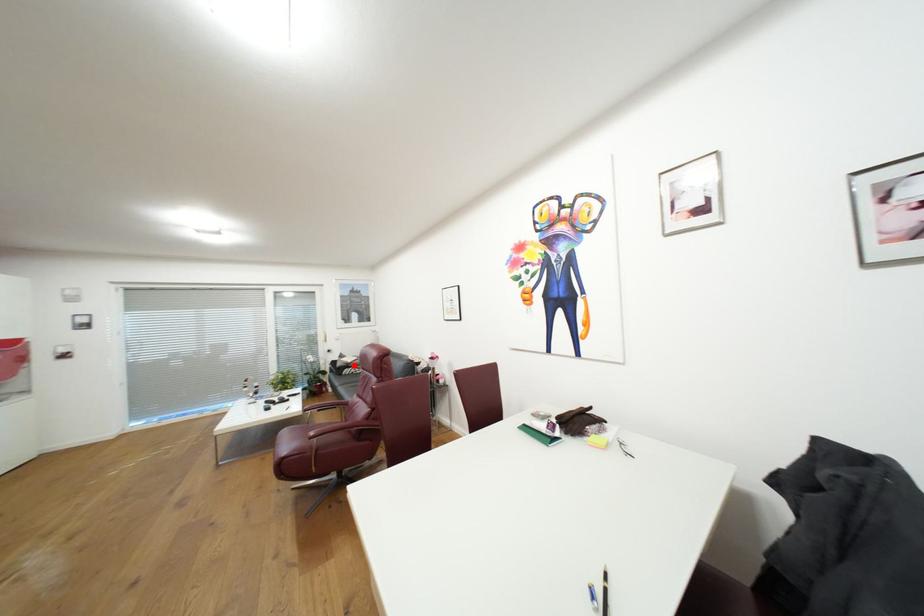
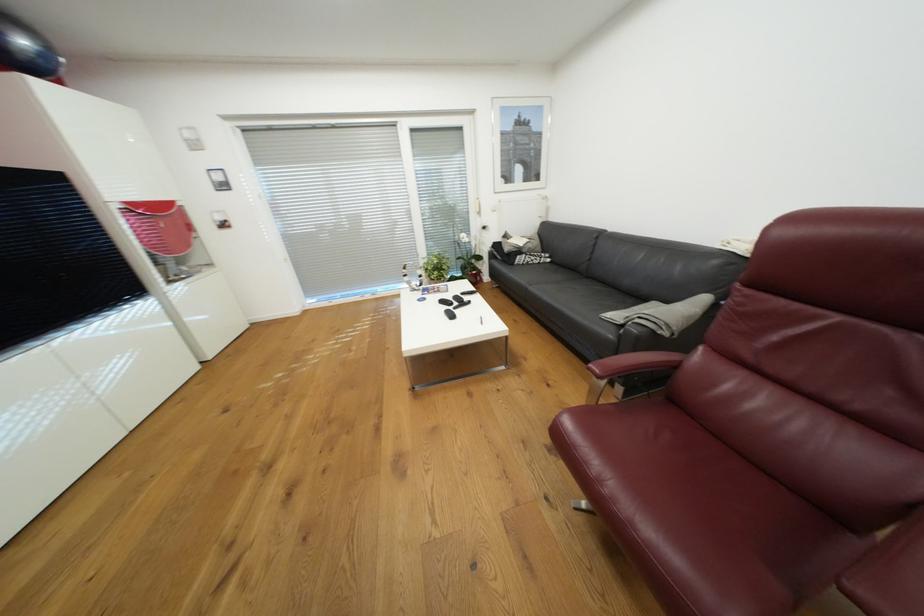
Locate, in the second image, the point that corresponds to the highlighted location in the first image.

(526, 252)